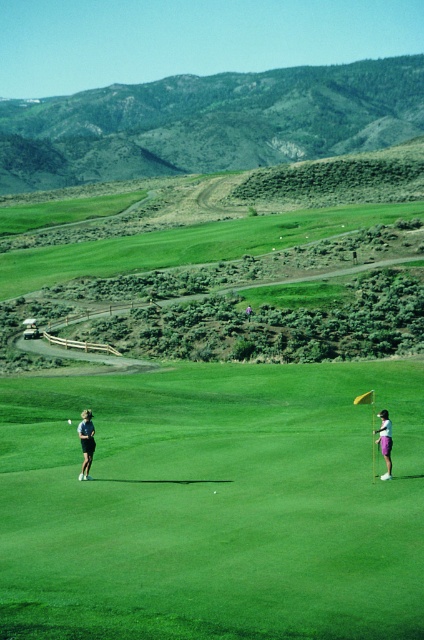
Based on the photo, does dark gray pants at left appear on the right side of purple fabric pants at right?

Incorrect, dark gray pants at left is not on the right side of purple fabric pants at right.

Between point (83, 435) and point (384, 460), which one is positioned behind?

Positioned behind is point (83, 435).

Is point (91, 413) positioned before point (384, 428)?

That is False.

This screenshot has height=640, width=424. I want to click on dark gray pants at left, so click(x=86, y=442).

Between point (117, 518) and point (89, 460), which one is positioned behind?

Point (89, 460)

Does green grassy golf course at center lie in front of dark gray pants at left?

Yes.

Is point (194, 458) positioned behind point (80, 435)?

That is True.

Locate an element on the screen. The width and height of the screenshot is (424, 640). green grassy golf course at center is located at coordinates (212, 506).

Is green grassy golf course at center positioned at the back of purple fabric pants at right?

No, green grassy golf course at center is in front of purple fabric pants at right.

Between point (28, 472) and point (390, 428), which one is positioned in front?

Positioned in front is point (390, 428).

Identify the location of green grassy golf course at center. (212, 506).